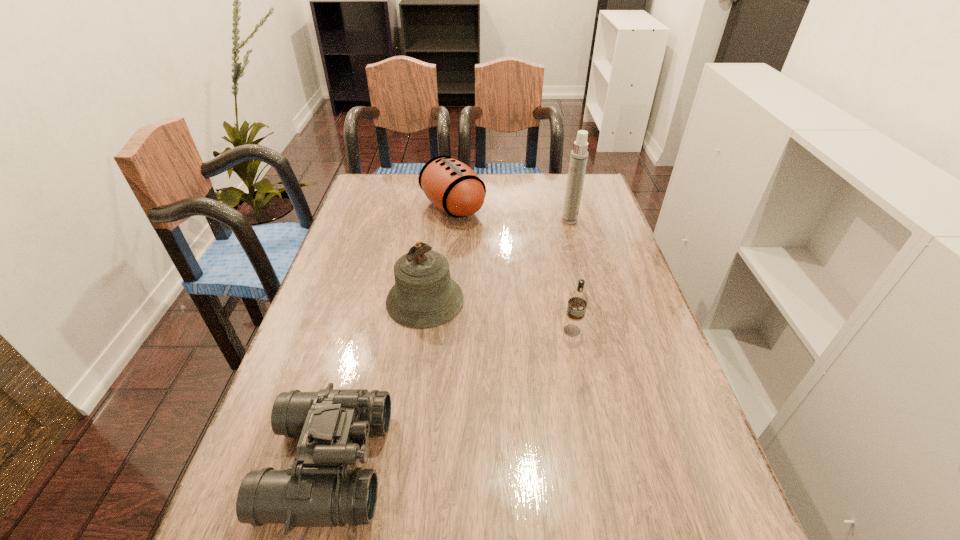
Find the location of a particular element. The width and height of the screenshot is (960, 540). vacant area that lies between the aerosol can and the football (American) is located at coordinates (511, 214).

This screenshot has width=960, height=540. I want to click on free area in between the tallest object and the fourth object from left to right, so click(571, 275).

Identify which object is located as the third nearest to the football (American). Please provide its 2D coordinates. Your answer should be formatted as a tuple, i.e. [(x, y)], where the tuple contains the x and y coordinates of a point satisfying the conditions above.

[(577, 300)]

Image resolution: width=960 pixels, height=540 pixels. Identify the location of object that stands as the closest to the nearest object. (424, 295).

I want to click on vacant position in the image that satisfies the following two spatial constraints: 1. on the back side of the rightmost object; 2. on the left side of the bell, so click(436, 220).

Where is `free space that satisfies the following two spatial constraints: 1. on the back side of the bell; 2. on the left side of the football (American)`? The height and width of the screenshot is (540, 960). free space that satisfies the following two spatial constraints: 1. on the back side of the bell; 2. on the left side of the football (American) is located at coordinates click(438, 207).